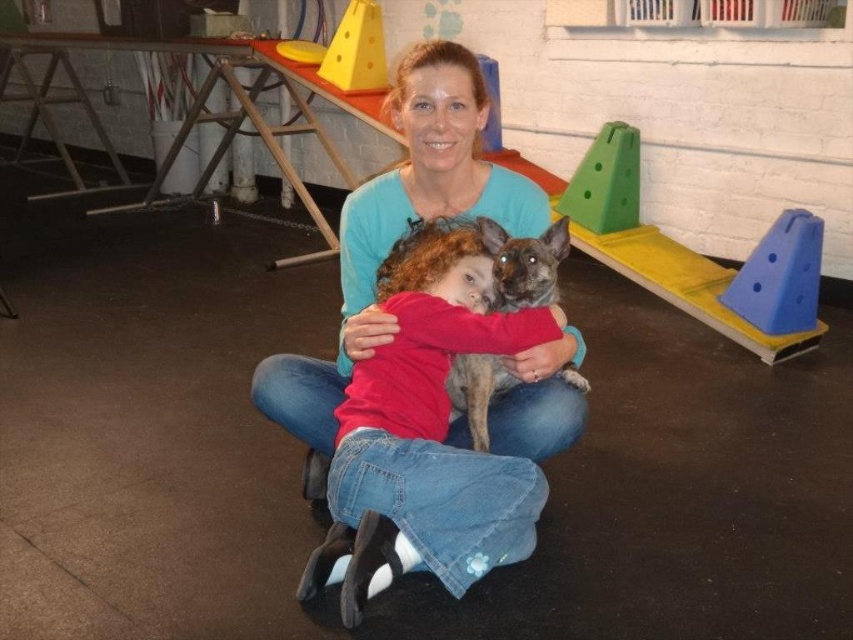
You are standing in the gymnasium and see two points marked on the floor. Which point is closer to you, point (409, 77) or point (494, 264)?

Point (409, 77) is further to the viewer than point (494, 264), so point (494, 264) is closer to you.

You are a photographer trying to capture a closeup of the speckled fur dog at center without including the matte blue shirt at center in the frame. Given their sizes, is this feasible?

The matte blue shirt at center is wider than the speckled fur dog at center, so it might block the view. To capture the dog without the shirt, position the camera so the dog is centered and the shirt is moved or angled out of the frame.

You are a photographer setting up for a family photo shoot in the gymnasium. You need to ensure the matte blue shirt at center and the speckled fur dog at center are both visible in the frame. Given their sizes, which object should you focus on to ensure both are in focus?

The matte blue shirt at center is larger than the speckled fur dog at center, so focusing on the matte blue shirt at center will help ensure both are in focus since it occupies more space in the frame.